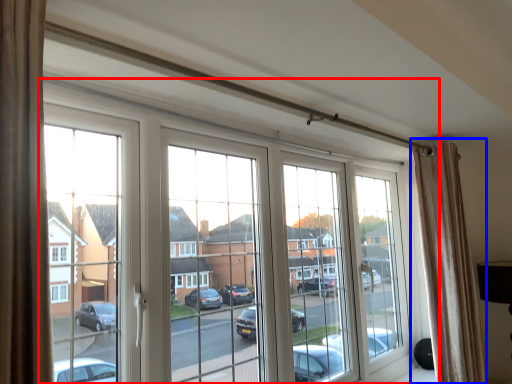
Question: Which object appears farthest to the camera in this image, window (highlighted by a red box) or curtain (highlighted by a blue box)?

Choices:
 (A) window
 (B) curtain

Answer: (B)